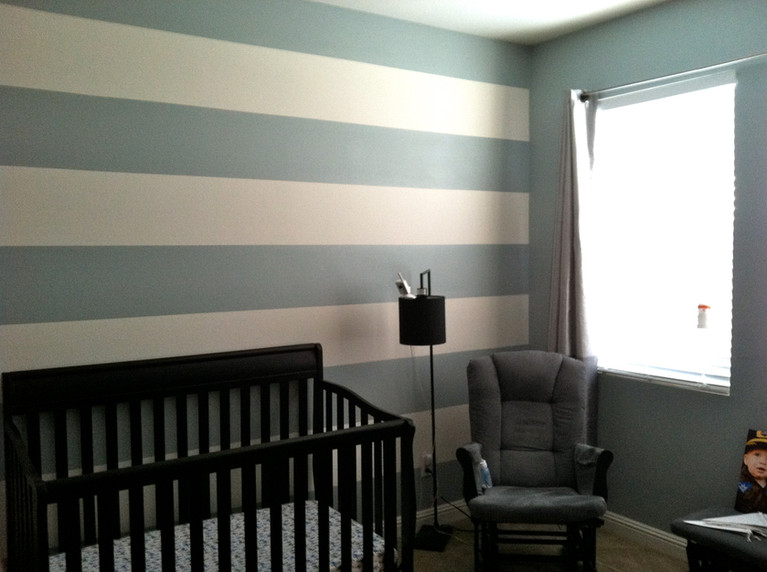
Locate an element on the screen. The width and height of the screenshot is (767, 572). dark brown wood baby bed is located at coordinates (216, 364).